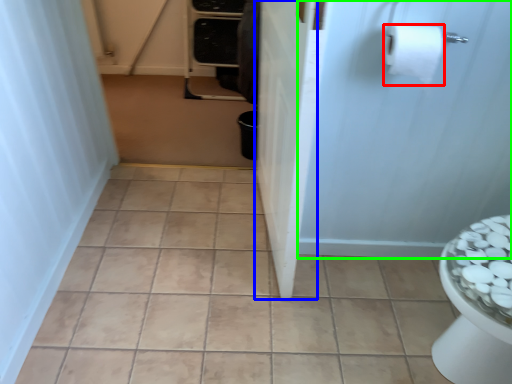
Question: Which object is the closest to the toilet paper (highlighted by a red box)? Choose among these: screen door (highlighted by a blue box) or screen door (highlighted by a green box).

Choices:
 (A) screen door
 (B) screen door

Answer: (B)